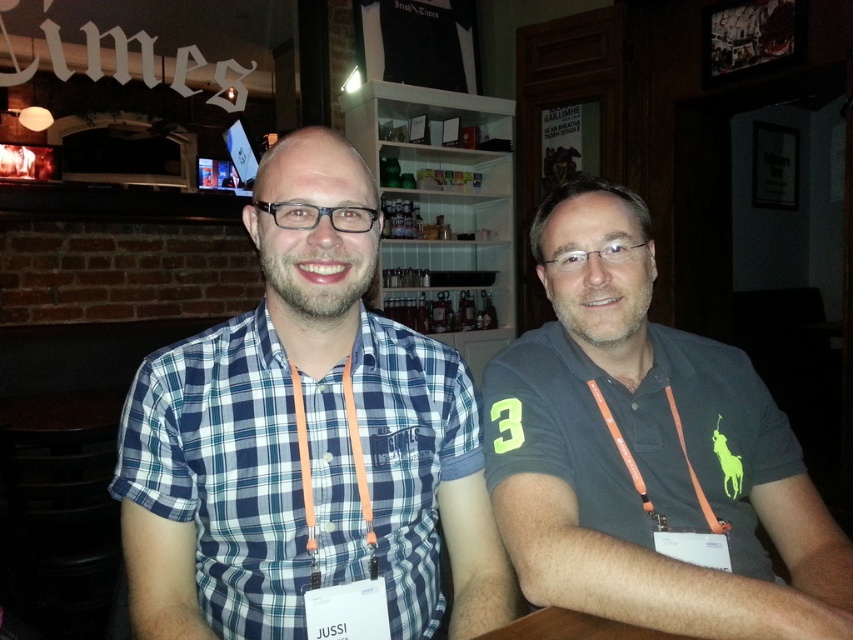
Question: Is blue plaid shirt at center to the right of dark gray polo shirt at right from the viewer's perspective?

Choices:
 (A) yes
 (B) no

Answer: (B)

Question: Can you confirm if blue plaid shirt at center is bigger than dark gray polo shirt at right?

Choices:
 (A) yes
 (B) no

Answer: (B)

Question: Can you confirm if blue plaid shirt at center is positioned below wooden table at center?

Choices:
 (A) yes
 (B) no

Answer: (B)

Question: Which object is farther from the camera taking this photo?

Choices:
 (A) dark gray polo shirt at right
 (B) wooden table at center

Answer: (B)

Question: Which of the following is the closest to the observer?

Choices:
 (A) blue plaid shirt at center
 (B) dark gray polo shirt at right

Answer: (B)

Question: Among these points, which one is nearest to the camera?

Choices:
 (A) (190, 358)
 (B) (612, 198)
 (C) (679, 637)

Answer: (C)